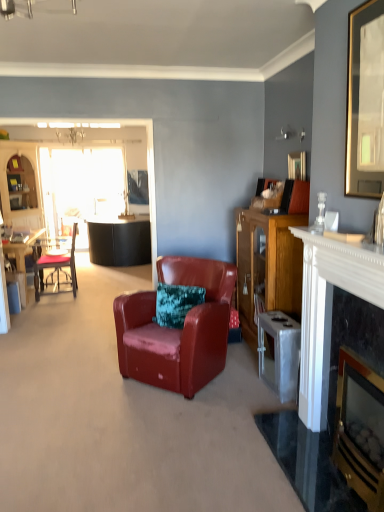
Question: From the image's perspective, is marble fireplace at right, which is counted as the second fireplace, starting from the right, located above black leather sofa at left, placed as the 1th entertainment center when sorted from front to back?

Choices:
 (A) no
 (B) yes

Answer: (A)

Question: Is marble fireplace at right, which is counted as the second fireplace, starting from the right, facing towards black leather sofa at left, arranged as the second entertainment center when viewed from the back?

Choices:
 (A) yes
 (B) no

Answer: (B)

Question: Is marble fireplace at right, arranged as the 1th fireplace when viewed from the left, to the left of black leather sofa at left, which appears as the first entertainment center when viewed from the right, from the viewer's perspective?

Choices:
 (A) yes
 (B) no

Answer: (B)

Question: Is marble fireplace at right, arranged as the 1th fireplace when viewed from the left, wider than black leather sofa at left, placed as the 1th entertainment center when sorted from front to back?

Choices:
 (A) no
 (B) yes

Answer: (A)

Question: Does marble fireplace at right, arranged as the 1th fireplace when viewed from the left, have a larger size compared to black leather sofa at left, placed as the 1th entertainment center when sorted from front to back?

Choices:
 (A) no
 (B) yes

Answer: (A)

Question: Would you say matte black chair at left, the 2th chair from the front, is inside or outside wooden cabinet at right?

Choices:
 (A) outside
 (B) inside

Answer: (A)

Question: Considering the positions of matte black chair at left, the second chair from the right, and wooden cabinet at right in the image, is matte black chair at left, the second chair from the right, taller or shorter than wooden cabinet at right?

Choices:
 (A) tall
 (B) short

Answer: (B)

Question: In the image, is matte black chair at left, which is the first chair from left to right, positioned in front of or behind wooden cabinet at right?

Choices:
 (A) behind
 (B) front

Answer: (A)

Question: From a real-world perspective, relative to wooden cabinet at right, is matte black chair at left, the second chair from the right, vertically above or below?

Choices:
 (A) above
 (B) below

Answer: (B)

Question: Which is correct: black leather sofa at left, placed as the 1th entertainment center when sorted from front to back, is inside black marble fireplace at right, the first fireplace from the right, or outside of it?

Choices:
 (A) outside
 (B) inside

Answer: (A)

Question: Considering their positions, is black leather sofa at left, which appears as the first entertainment center when viewed from the right, located in front of or behind black marble fireplace at right, the first fireplace from the right?

Choices:
 (A) front
 (B) behind

Answer: (B)

Question: Considering the positions of black leather sofa at left, arranged as the second entertainment center when viewed from the back, and black marble fireplace at right, the first fireplace from the right, in the image, is black leather sofa at left, arranged as the second entertainment center when viewed from the back, wider or thinner than black marble fireplace at right, the first fireplace from the right,?

Choices:
 (A) thin
 (B) wide

Answer: (A)

Question: Considering the positions of point (61, 148) and point (375, 486), is point (61, 148) closer or farther from the camera than point (375, 486)?

Choices:
 (A) farther
 (B) closer

Answer: (A)

Question: Is metallic silver trash can at right wider or thinner than wooden cabinet at left, which is the second entertainment center in right-to-left order?

Choices:
 (A) wide
 (B) thin

Answer: (B)

Question: Choose the correct answer: Is metallic silver trash can at right inside wooden cabinet at left, which is the 2th entertainment center in front-to-back order, or outside it?

Choices:
 (A) outside
 (B) inside

Answer: (A)